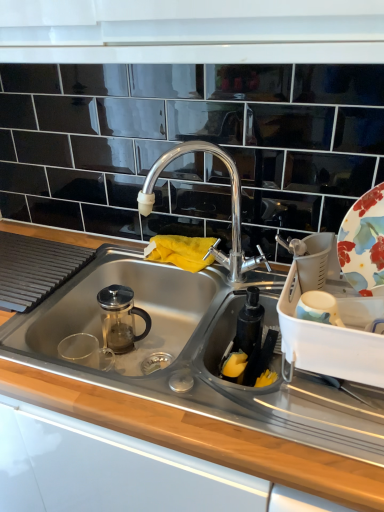
Question: Is stainless steel sink at center shorter than floral ceramic platter at right?

Choices:
 (A) yes
 (B) no

Answer: (A)

Question: Is stainless steel sink at center thinner than floral ceramic platter at right?

Choices:
 (A) yes
 (B) no

Answer: (B)

Question: From the image's perspective, does stainless steel sink at center appear higher than floral ceramic platter at right?

Choices:
 (A) yes
 (B) no

Answer: (B)

Question: Is floral ceramic platter at right completely or partially inside stainless steel sink at center?

Choices:
 (A) no
 (B) yes

Answer: (A)

Question: Is stainless steel sink at center outside floral ceramic platter at right?

Choices:
 (A) yes
 (B) no

Answer: (A)

Question: Does stainless steel sink at center appear on the right side of floral ceramic platter at right?

Choices:
 (A) yes
 (B) no

Answer: (B)

Question: Is polished chrome faucet at center smaller than floral ceramic platter at right?

Choices:
 (A) no
 (B) yes

Answer: (A)

Question: From a real-world perspective, is polished chrome faucet at center located higher than floral ceramic platter at right?

Choices:
 (A) no
 (B) yes

Answer: (A)

Question: From a real-world perspective, is polished chrome faucet at center beneath floral ceramic platter at right?

Choices:
 (A) yes
 (B) no

Answer: (A)

Question: From the image's perspective, is polished chrome faucet at center over floral ceramic platter at right?

Choices:
 (A) no
 (B) yes

Answer: (B)

Question: Is floral ceramic platter at right a part of polished chrome faucet at center?

Choices:
 (A) yes
 (B) no

Answer: (B)

Question: Considering the relative positions of polished chrome faucet at center and floral ceramic platter at right in the image provided, is polished chrome faucet at center to the left of floral ceramic platter at right from the viewer's perspective?

Choices:
 (A) no
 (B) yes

Answer: (B)

Question: Is stainless steel sink at center wider than polished chrome faucet at center?

Choices:
 (A) no
 (B) yes

Answer: (B)